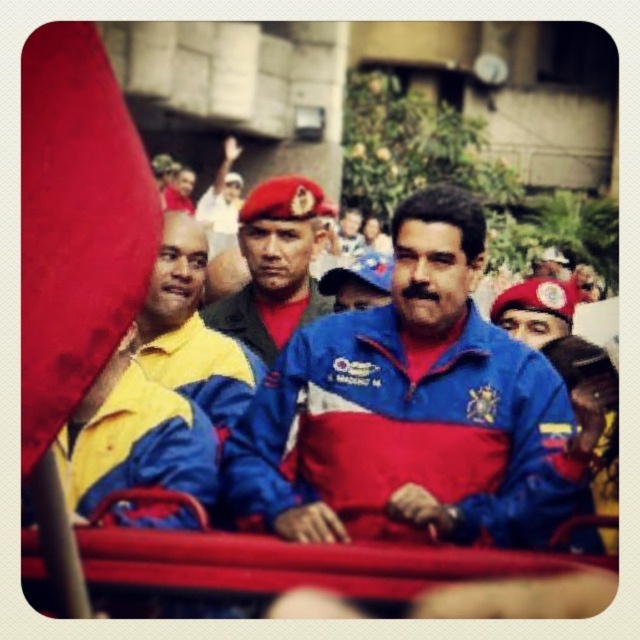
Question: Is smooth red flag at left positioned behind yellow fabric shirt at left?

Choices:
 (A) yes
 (B) no

Answer: (B)

Question: Is blue/red zip-up jacket at center closer to the viewer compared to yellow fabric shirt at left?

Choices:
 (A) no
 (B) yes

Answer: (B)

Question: Considering the real-world distances, which object is farthest from the smooth red flag at left?

Choices:
 (A) yellow fabric shirt at left
 (B) blue/red zip-up jacket at center

Answer: (A)

Question: Which of these objects is positioned closest to the blue/red zip-up jacket at center?

Choices:
 (A) matte red beret at center
 (B) yellow fabric shirt at left
 (C) smooth red flag at left

Answer: (B)

Question: Does yellow fabric shirt at left lie in front of matte red beret at center?

Choices:
 (A) no
 (B) yes

Answer: (B)

Question: Which object is closer to the camera taking this photo?

Choices:
 (A) blue/red zip-up jacket at center
 (B) yellow fabric shirt at left
 (C) matte red beret at center

Answer: (A)